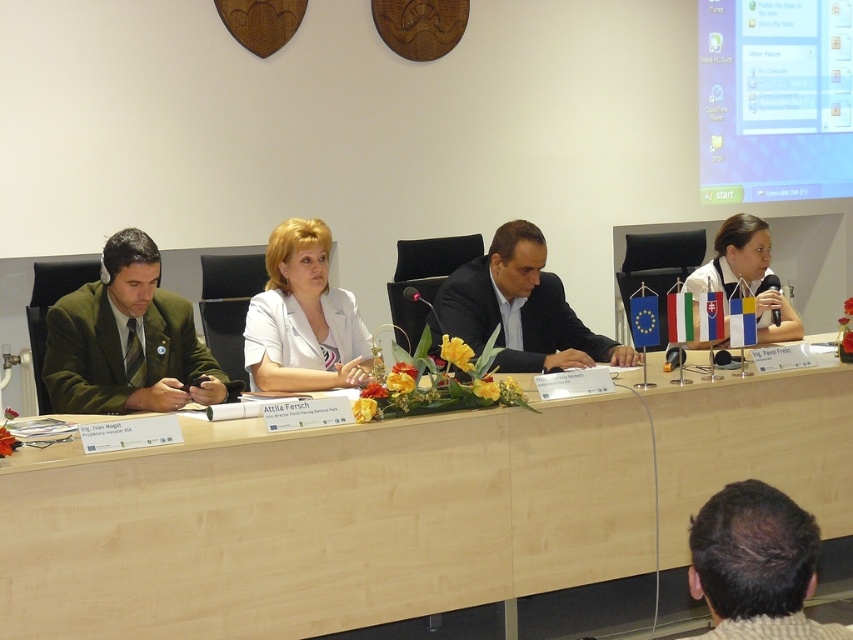
Does light wood table at center appear on the left side of green matte suit at left?

In fact, light wood table at center is to the right of green matte suit at left.

Is light wood table at center further to camera compared to green matte suit at left?

No.

Identify the location of light wood table at center. (322, 522).

Find the location of a particular element. The image size is (853, 640). light wood table at center is located at coordinates (322, 522).

Which is more to the left, dark brown hair at lower right or white matte jacket at center?

Positioned to the left is white matte jacket at center.

Between dark brown hair at lower right and white matte jacket at center, which one has less height?

dark brown hair at lower right is shorter.

Which is in front, point (723, 563) or point (312, 243)?

Point (723, 563) is more forward.

Locate an element on the screen. dark brown hair at lower right is located at coordinates pos(756,564).

Who is shorter, light wood table at center or white glossy microphone at upper right?

white glossy microphone at upper right

Is light wood table at center bigger than white glossy microphone at upper right?

Correct, light wood table at center is larger in size than white glossy microphone at upper right.

Find the location of a particular element. light wood table at center is located at coordinates (322, 522).